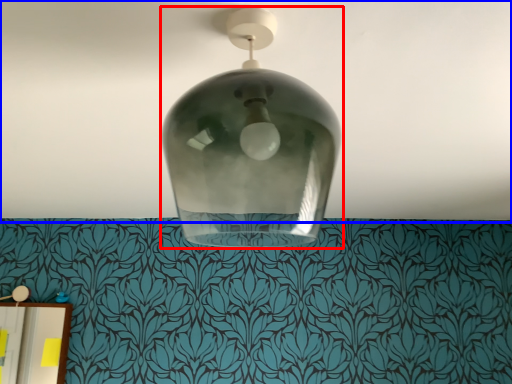
Question: Which object is closer to the camera taking this photo, lamp (highlighted by a red box) or atmosphere (highlighted by a blue box)?

Choices:
 (A) lamp
 (B) atmosphere

Answer: (A)